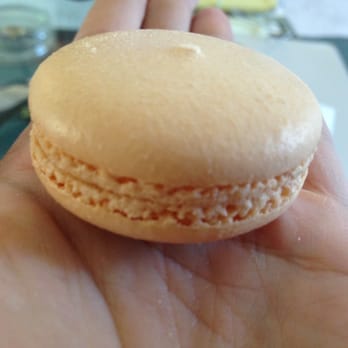
Find the location of a particular element. The width and height of the screenshot is (348, 348). table is located at coordinates (307, 59).